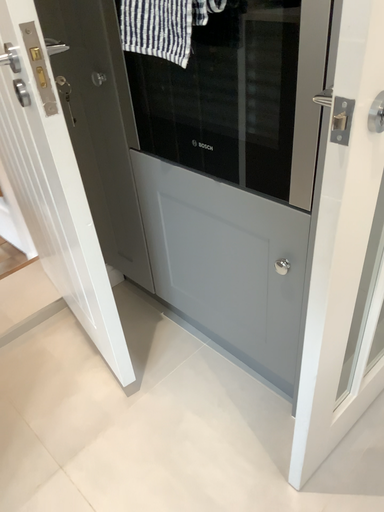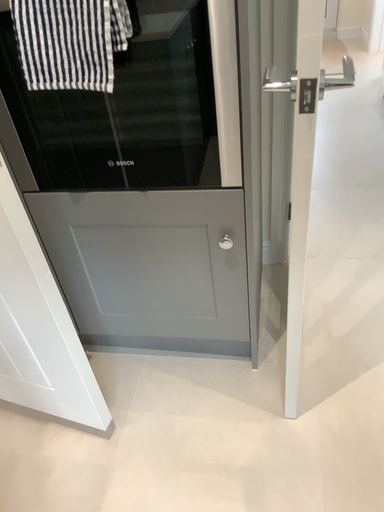
Question: Which way did the camera rotate in the video?

Choices:
 (A) rotated left
 (B) rotated right

Answer: (B)